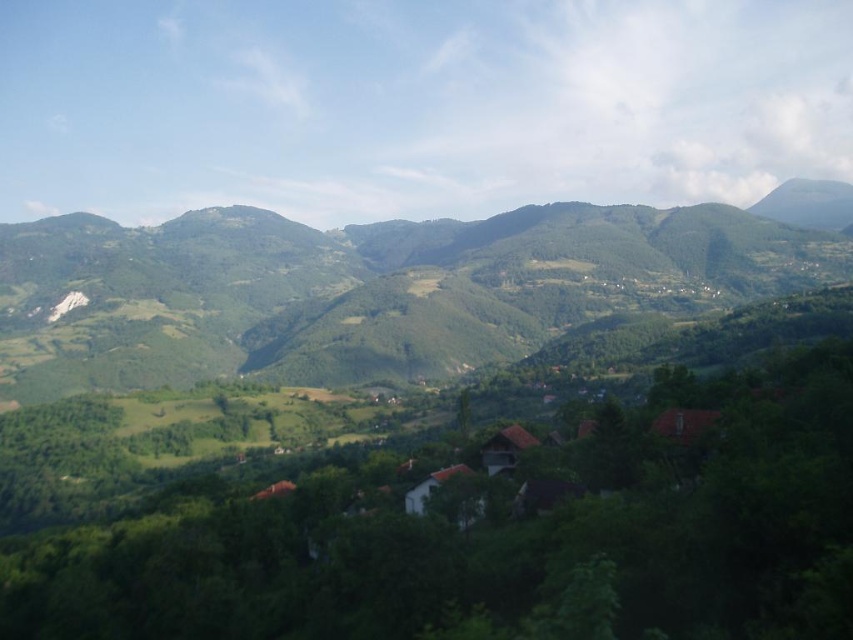
Question: Which of the following is the closest to the observer?

Choices:
 (A) (526, 541)
 (B) (583, 433)
 (C) (165, 364)

Answer: (A)

Question: Does green textured hillside at center come in front of brown tiled roofs at center?

Choices:
 (A) no
 (B) yes

Answer: (A)

Question: Which object appears closest to the camera in this image?

Choices:
 (A) green textured hillside at center
 (B) brown tiled roofs at center

Answer: (B)

Question: Does green leafy mountain at center have a greater width compared to brown tiled roofs at center?

Choices:
 (A) no
 (B) yes

Answer: (B)

Question: Which object is the farthest from the brown tiled roofs at center?

Choices:
 (A) green textured hillside at center
 (B) green leafy mountain at center

Answer: (A)

Question: Does green textured hillside at center have a smaller size compared to brown tiled roofs at center?

Choices:
 (A) no
 (B) yes

Answer: (A)